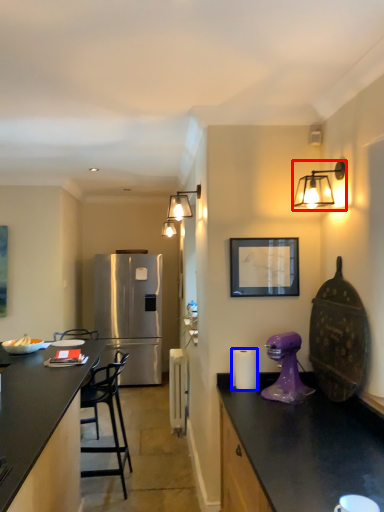
Question: Which object appears closest to the camera in this image, light fixture (highlighted by a red box) or paper towel (highlighted by a blue box)?

Choices:
 (A) light fixture
 (B) paper towel

Answer: (A)